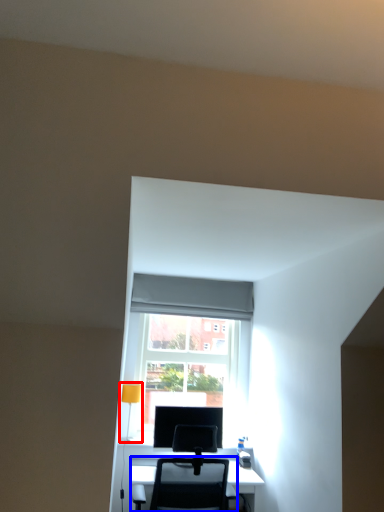
Question: Among these objects, which one is farthest to the camera, table lamp (highlighted by a red box) or chair (highlighted by a blue box)?

Choices:
 (A) table lamp
 (B) chair

Answer: (A)